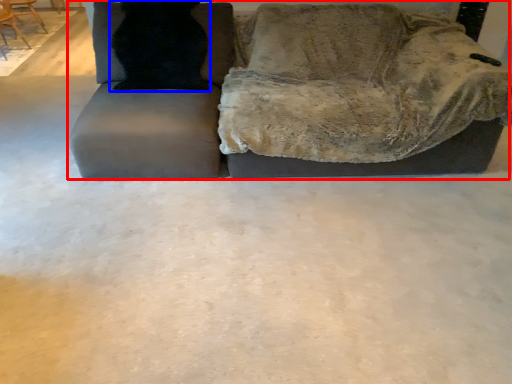
Question: Which object is closer to the camera taking this photo, studio couch (highlighted by a red box) or cat (highlighted by a blue box)?

Choices:
 (A) studio couch
 (B) cat

Answer: (A)